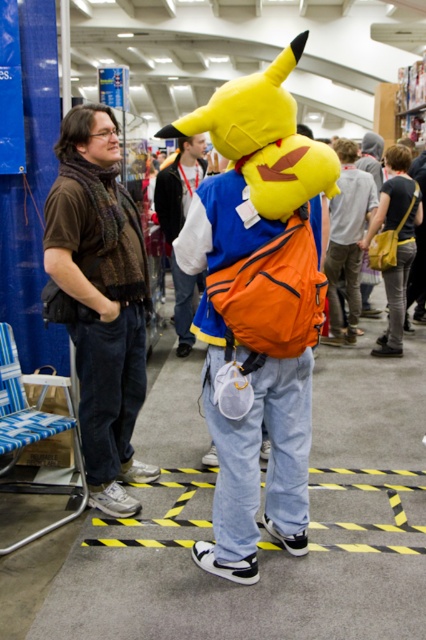
Question: Does brown woven scarf at left appear under orange fabric backpack at center?

Choices:
 (A) no
 (B) yes

Answer: (B)

Question: Considering the real-world distances, which object is closest to the denim pants at center?

Choices:
 (A) orange fabric backpack at center
 (B) brown woven scarf at left

Answer: (A)

Question: Which of the following is the farthest from the observer?

Choices:
 (A) (89, 269)
 (B) (198, 172)
 (C) (330, 221)

Answer: (B)

Question: From the image, what is the correct spatial relationship of brown woven scarf at left in relation to orange fabric backpack at center?

Choices:
 (A) left
 (B) right

Answer: (A)

Question: From the image, what is the correct spatial relationship of denim pants at center in relation to orange fabric backpack at center?

Choices:
 (A) below
 (B) above

Answer: (B)

Question: Which point is closer to the camera?

Choices:
 (A) (80, 241)
 (B) (180, 179)

Answer: (A)